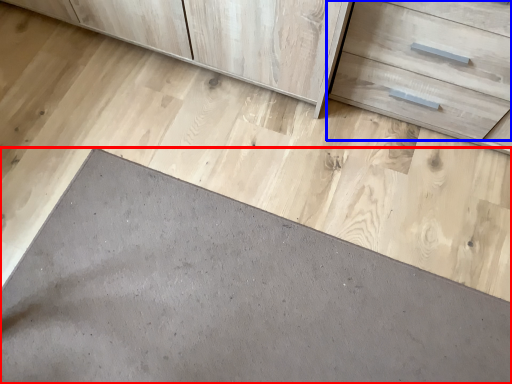
Question: Which of the following is the closest to the observer, slate (highlighted by a red box) or drawer (highlighted by a blue box)?

Choices:
 (A) slate
 (B) drawer

Answer: (B)